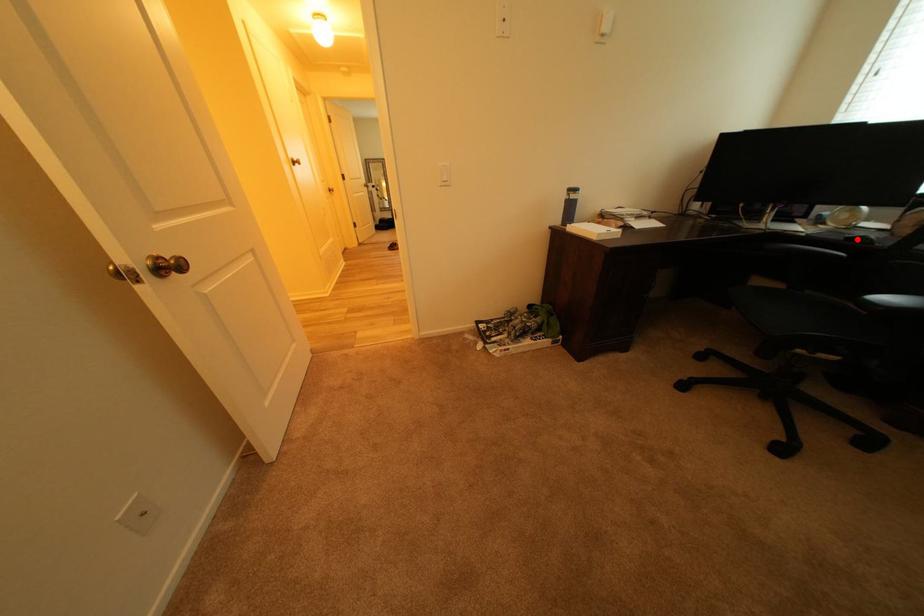
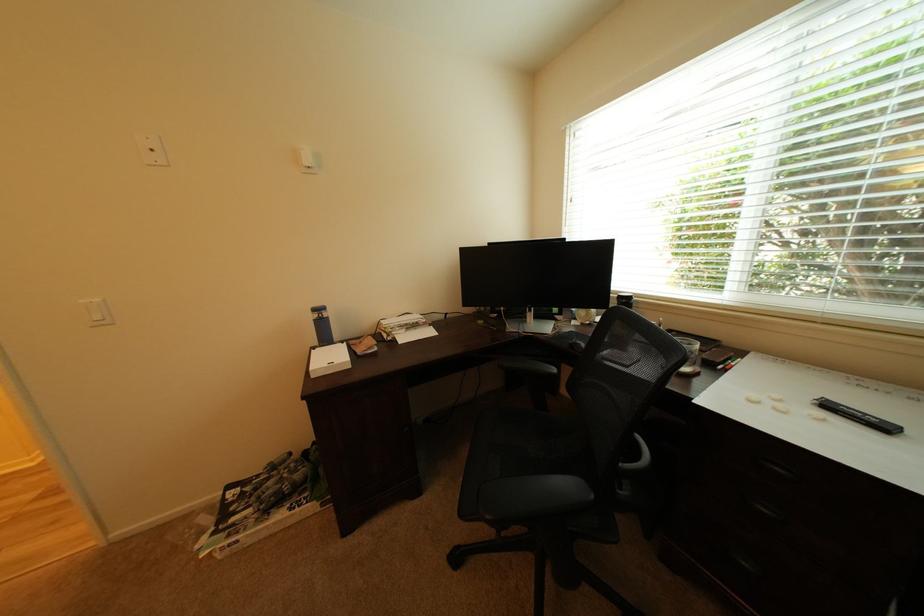
Question: I am providing you with two images of the same scene from different viewpoints. A red point is shown in image1. For the corresponding object point in image2, is it positioned nearer or farther from the camera?

Choices:
 (A) Nearer
 (B) Farther

Answer: (A)